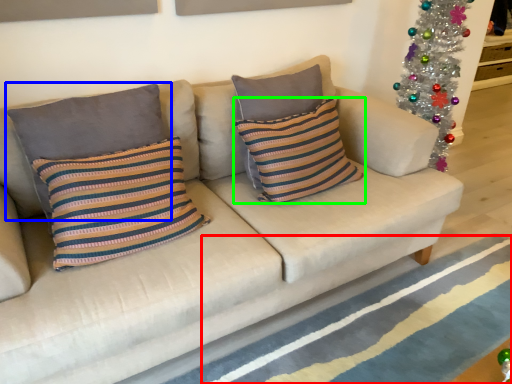
Question: Which object is positioned closest to stripe (highlighted by a red box)? Select from pillow (highlighted by a blue box) and pillow (highlighted by a green box).

Choices:
 (A) pillow
 (B) pillow

Answer: (B)